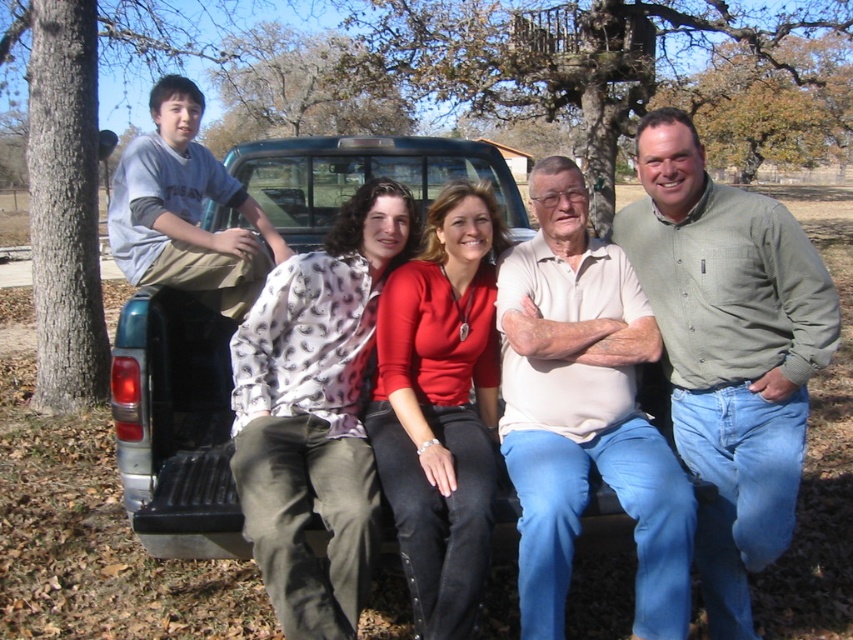
Does teal matte truck bed at center have a larger size compared to matte red blouse at center?

Indeed, teal matte truck bed at center has a larger size compared to matte red blouse at center.

Which is more to the left, teal matte truck bed at center or matte red blouse at center?

From the viewer's perspective, teal matte truck bed at center appears more on the left side.

In order to click on teal matte truck bed at center in this screenshot , I will do `click(175, 426)`.

Is point (320, 452) farther from camera compared to point (149, 499)?

That is False.

Where is `matte black truck at center`? The image size is (853, 640). matte black truck at center is located at coordinates (315, 413).

Looking at this image, between green button-down shirt at center and matte red blouse at center, which one appears on the left side from the viewer's perspective?

matte red blouse at center is more to the left.

How distant is green button-down shirt at center from matte red blouse at center?

green button-down shirt at center is 29.40 inches from matte red blouse at center.

Identify the location of green button-down shirt at center. click(x=729, y=349).

Find the location of a particular element. The height and width of the screenshot is (640, 853). green button-down shirt at center is located at coordinates (729, 349).